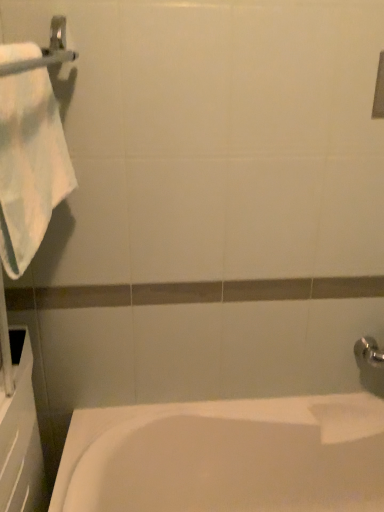
Describe the element at coordinates (29, 166) in the screenshot. This screenshot has height=512, width=384. I see `white cotton towel at left` at that location.

At what (x,y) coordinates should I click in order to perform the action: click on white cotton towel at left. Please return your answer as a coordinate pair (x, y). The width and height of the screenshot is (384, 512). Looking at the image, I should click on (29, 166).

In terms of height, does silver metallic towel bar at upper left look taller or shorter compared to white glossy bathtub at lower left?

Clearly, silver metallic towel bar at upper left is shorter compared to white glossy bathtub at lower left.

How far apart are silver metallic towel bar at upper left and white glossy bathtub at lower left?

silver metallic towel bar at upper left is 1.10 meters away from white glossy bathtub at lower left.

Consider the image. Does silver metallic towel bar at upper left turn towards white glossy bathtub at lower left?

No, silver metallic towel bar at upper left is not facing towards white glossy bathtub at lower left.

Between point (69, 161) and point (326, 459), which one is positioned behind?

The point (326, 459) is more distant.

From the image's perspective, relative to white glossy bathtub at lower left, is white cotton towel at left above or below?

white cotton towel at left is situated higher than white glossy bathtub at lower left in the image.

Relative to white glossy bathtub at lower left, is white cotton towel at left in front or behind?

white cotton towel at left is positioned closer to the viewer than white glossy bathtub at lower left.

Can you confirm if white cotton towel at left is positioned to the left of white glossy bathtub at lower left?

Indeed, white cotton towel at left is positioned on the left side of white glossy bathtub at lower left.

Would you say white glossy bathtub at lower left is a long distance from silver metallic towel bar at upper left?

Yes.

Which of these two, white glossy bathtub at lower left or silver metallic towel bar at upper left, is smaller?

silver metallic towel bar at upper left is smaller.

Identify the location of bathtub on the right of silver metallic towel bar at upper left. (226, 456).

In the image, there is a silver metallic towel bar at upper left. What are the coordinates of `towel below it (from the image's perspective)` in the screenshot? It's located at (29, 166).

Can you confirm if silver metallic towel bar at upper left is smaller than white cotton towel at left?

Yes, silver metallic towel bar at upper left is smaller than white cotton towel at left.

Which is more to the right, silver metallic towel bar at upper left or white cotton towel at left?

Positioned to the right is silver metallic towel bar at upper left.

From the image's perspective, is silver metallic towel bar at upper left beneath white cotton towel at left?

No.

How different are the orientations of white glossy bathtub at lower left and white cotton towel at left in degrees?

The angular difference between white glossy bathtub at lower left and white cotton towel at left is 92.8 degrees.

Which of these two, white glossy bathtub at lower left or white cotton towel at left, stands shorter?

white cotton towel at left.

Considering the sizes of objects white glossy bathtub at lower left and white cotton towel at left in the image provided, who is bigger, white glossy bathtub at lower left or white cotton towel at left?

white glossy bathtub at lower left is bigger.

Are white glossy bathtub at lower left and white cotton towel at left beside each other?

No, white glossy bathtub at lower left is not beside white cotton towel at left.

Consider the image. Who is shorter, white cotton towel at left or silver metallic towel bar at upper left?

silver metallic towel bar at upper left is shorter.

From a real-world perspective, is white cotton towel at left below silver metallic towel bar at upper left?

Yes.

Can we say white cotton towel at left lies outside silver metallic towel bar at upper left?

Absolutely, white cotton towel at left is external to silver metallic towel bar at upper left.

In the image, is white cotton towel at left positioned in front of or behind silver metallic towel bar at upper left?

white cotton towel at left is positioned farther from the viewer than silver metallic towel bar at upper left.

The height and width of the screenshot is (512, 384). I want to click on towel bar above the white glossy bathtub at lower left (from a real-world perspective), so click(x=45, y=51).

You are a GUI agent. You are given a task and a screenshot of the screen. Output one action in this format:
    pyautogui.click(x=<x>, y=<y>)
    Task: Click on the towel that is on the left side of white glossy bathtub at lower left
    
    Given the screenshot: What is the action you would take?
    pyautogui.click(x=29, y=166)

Considering their positions, is silver metallic towel bar at upper left positioned further to white cotton towel at left than white glossy bathtub at lower left?

white glossy bathtub at lower left is further to white cotton towel at left.

From the image, which object appears to be nearer to silver metallic towel bar at upper left, white glossy bathtub at lower left or white cotton towel at left?

white cotton towel at left is positioned closer to the anchor silver metallic towel bar at upper left.

Looking at the image, which one is located closer to white glossy bathtub at lower left, silver metallic towel bar at upper left or white cotton towel at left?

white cotton towel at left lies closer to white glossy bathtub at lower left than the other object.

Estimate the real-world distances between objects in this image. Which object is further from white cotton towel at left, white glossy bathtub at lower left or silver metallic towel bar at upper left?

The object further to white cotton towel at left is white glossy bathtub at lower left.

Based on their spatial positions, is white cotton towel at left or silver metallic towel bar at upper left further from white glossy bathtub at lower left?

Based on the image, silver metallic towel bar at upper left appears to be further to white glossy bathtub at lower left.

Consider the image. When comparing their distances from silver metallic towel bar at upper left, does white cotton towel at left or white glossy bathtub at lower left seem further?

Based on the image, white glossy bathtub at lower left appears to be further to silver metallic towel bar at upper left.

Image resolution: width=384 pixels, height=512 pixels. I want to click on towel that lies between silver metallic towel bar at upper left and white glossy bathtub at lower left from top to bottom, so click(x=29, y=166).